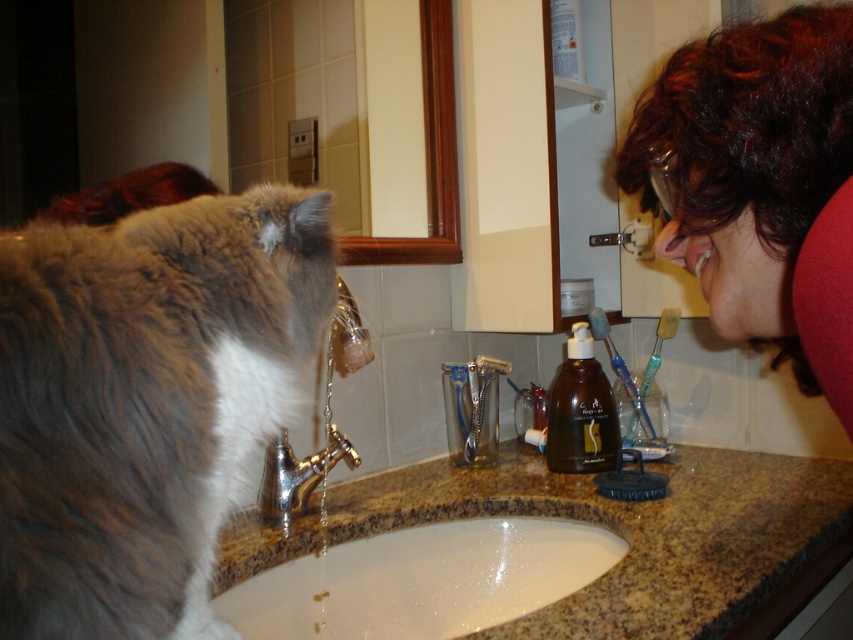
You are standing in the bathroom and want to place a small decorative item on one of the two points marked in the image. The first point is at coordinates point (335, 556) and the second is at point (347, 445). Which point is closer to you so the item will be more visible?

Point (335, 556) is closer to the viewer than point (347, 445), so placing the decorative item there would make it more visible.

You are a photographer taking a portrait in this bathroom. You want to ensure both the matte red hair at upper right and the gold metallic faucet at sink center are visible in the frame. Which object should you position closer to the camera to include both in the composition?

To include both the matte red hair at upper right and the gold metallic faucet at sink center in the composition, position the matte red hair at upper right closer to the camera since it has a greater height compared to the gold metallic faucet at sink center.

You are a person with a 12 inch long toothbrush. You are standing in front of the white marble sink at center and want to reach the faucet to rinse your toothbrush. Can you reach the faucet without moving your feet?

The white marble sink at center is 38.21 inches away from viewer. Since the toothbrush is 12 inches long, you can extend your arm to reach the faucet beyond the sink.